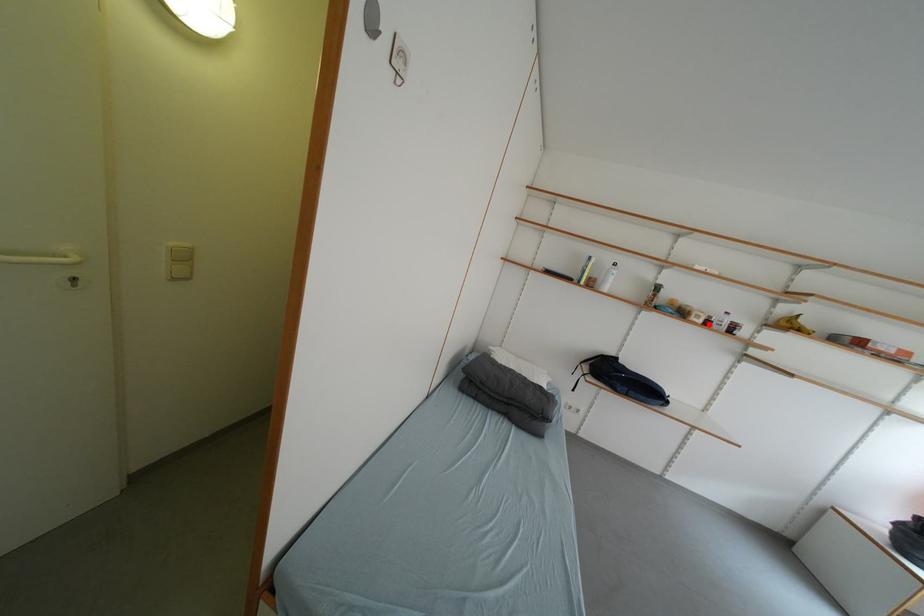
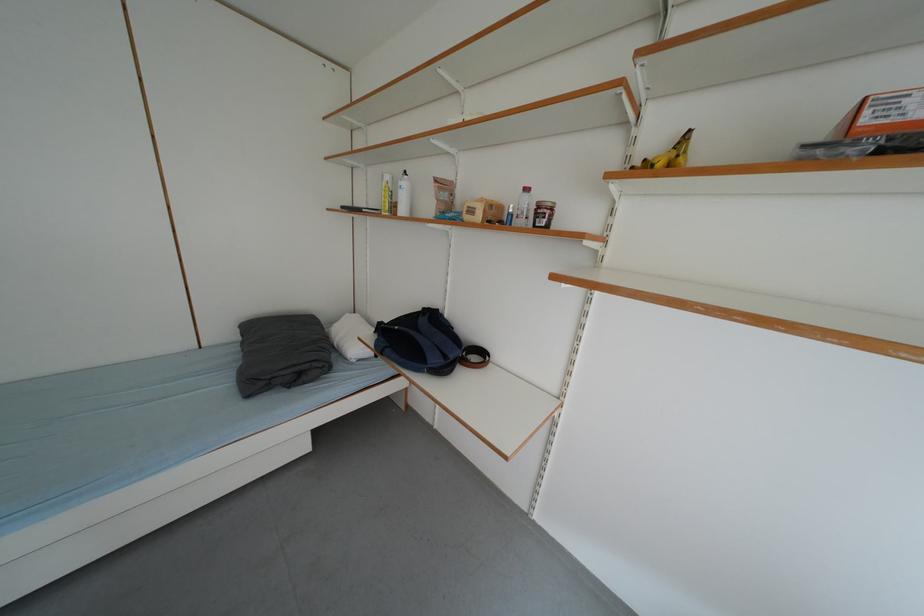
Locate, in the second image, the point that corresponds to the highlighted location in the first image.

(487, 220)